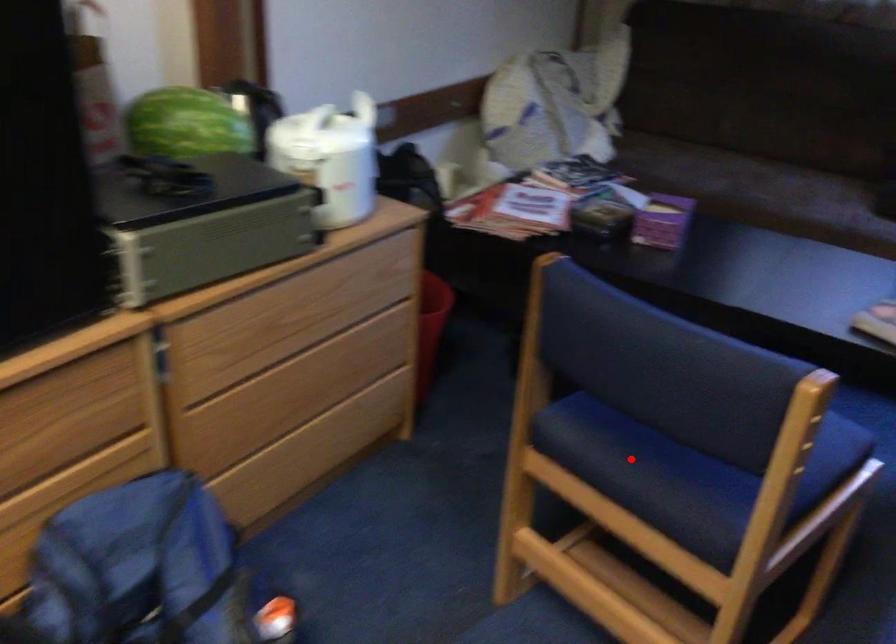
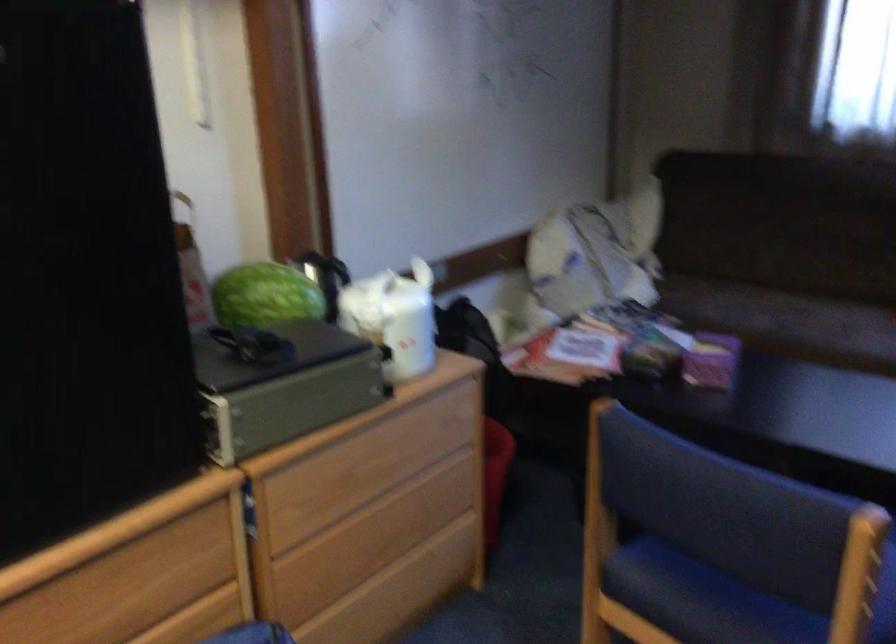
Find the pixel in the second image that matches the highlighted location in the first image.

(702, 599)